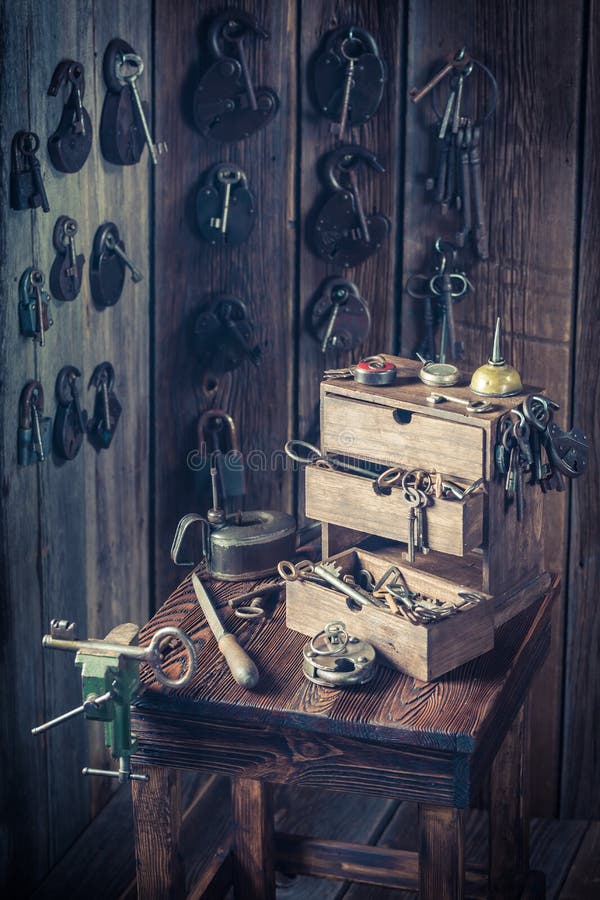
Identify the location of wooden drawers in chest. Image resolution: width=600 pixels, height=900 pixels. (407, 427), (352, 501), (392, 642).